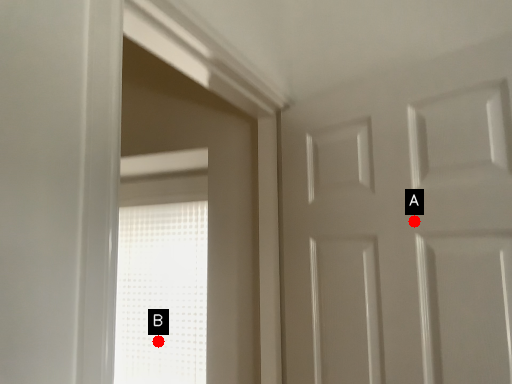
Question: Two points are circled on the image, labeled by A and B beside each circle. Which of the following is the farthest from the observer?

Choices:
 (A) A is further
 (B) B is further

Answer: (B)